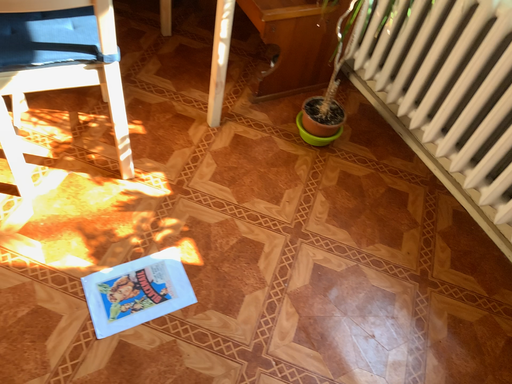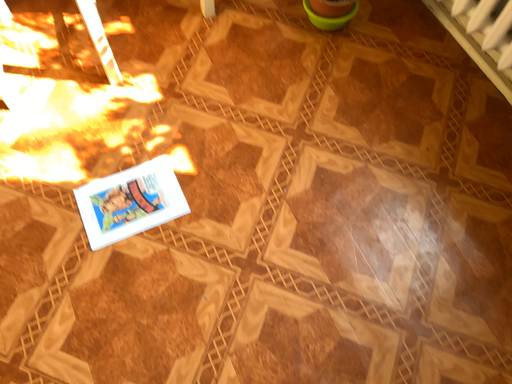
Question: Which way did the camera rotate in the video?

Choices:
 (A) rotated right
 (B) rotated left

Answer: (B)